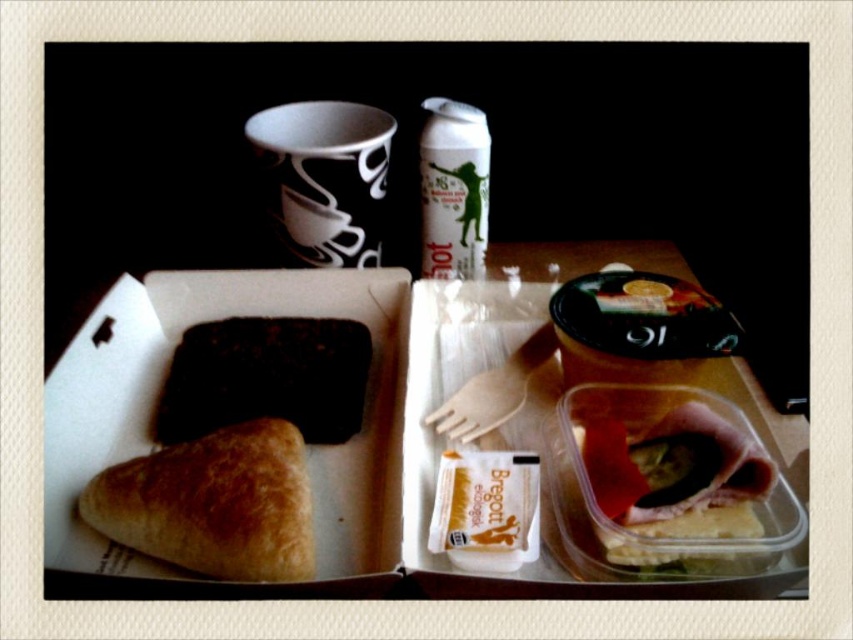
Question: Based on their relative distances, which object is nearer to the golden brown flaky croissant at lower left?

Choices:
 (A) translucent plastic container at center
 (B) dark chocolate bar at center

Answer: (B)

Question: Is golden brown flaky croissant at lower left behind dark chocolate bar at center?

Choices:
 (A) no
 (B) yes

Answer: (A)

Question: Which of these objects is positioned closest to the dark chocolate bar at center?

Choices:
 (A) golden brown flaky croissant at lower left
 (B) translucent plastic container at center

Answer: (A)

Question: Which point is closer to the camera taking this photo?

Choices:
 (A) (656, 504)
 (B) (256, 387)
 (C) (151, 488)

Answer: (C)

Question: Does translucent plastic container at center have a lesser width compared to dark chocolate bar at center?

Choices:
 (A) yes
 (B) no

Answer: (A)

Question: Can you confirm if translucent plastic container at center is bigger than dark chocolate bar at center?

Choices:
 (A) no
 (B) yes

Answer: (B)